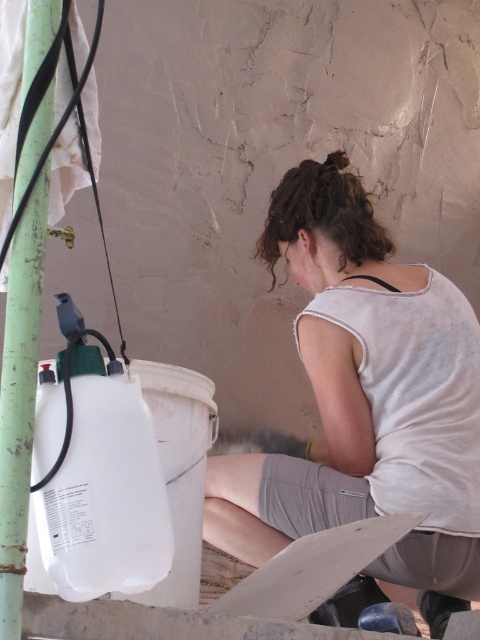
Question: Can you confirm if white matte tank top at center is wider than green painted metal pole at left?

Choices:
 (A) yes
 (B) no

Answer: (A)

Question: Among these objects, which one is farthest from the camera?

Choices:
 (A) white matte tank top at center
 (B) green painted metal pole at left

Answer: (A)

Question: Is white matte tank top at center above green painted metal pole at left?

Choices:
 (A) yes
 (B) no

Answer: (B)

Question: Can you confirm if white matte tank top at center is smaller than green painted metal pole at left?

Choices:
 (A) yes
 (B) no

Answer: (B)

Question: Which of the following is the closest to the observer?

Choices:
 (A) white matte tank top at center
 (B) green painted metal pole at left

Answer: (B)